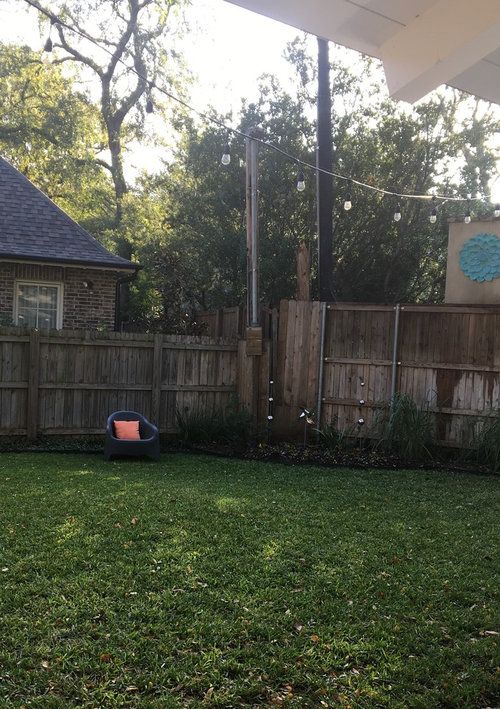
This screenshot has height=709, width=500. In order to click on window in this screenshot , I will do `click(46, 303)`.